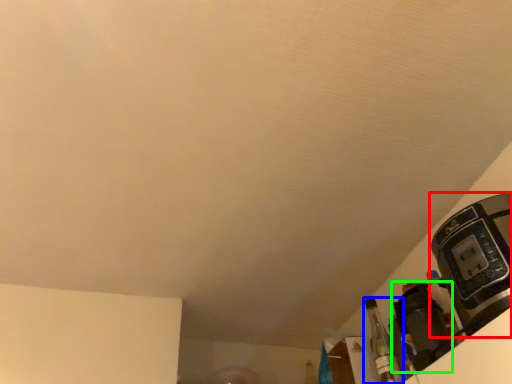
Question: Which object is positioned farthest from coffee machine (highlighted by a red box)? Select from bottle (highlighted by a blue box) and appliance (highlighted by a green box).

Choices:
 (A) bottle
 (B) appliance

Answer: (A)